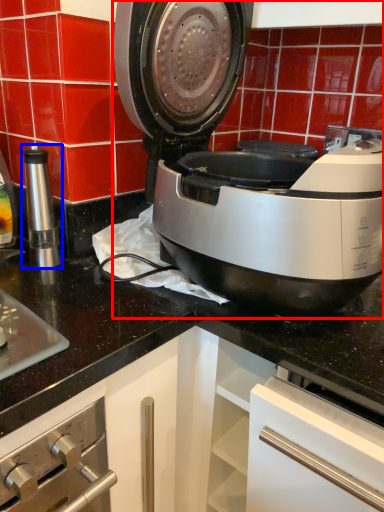
Question: Which point is further to the camera, home appliance (highlighted by a red box) or kitchen appliance (highlighted by a blue box)?

Choices:
 (A) home appliance
 (B) kitchen appliance

Answer: (B)